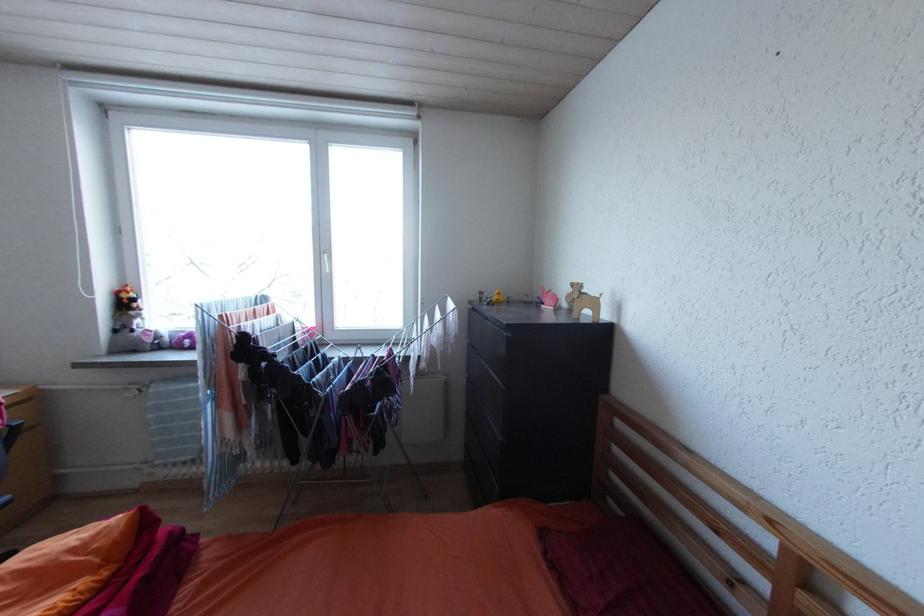
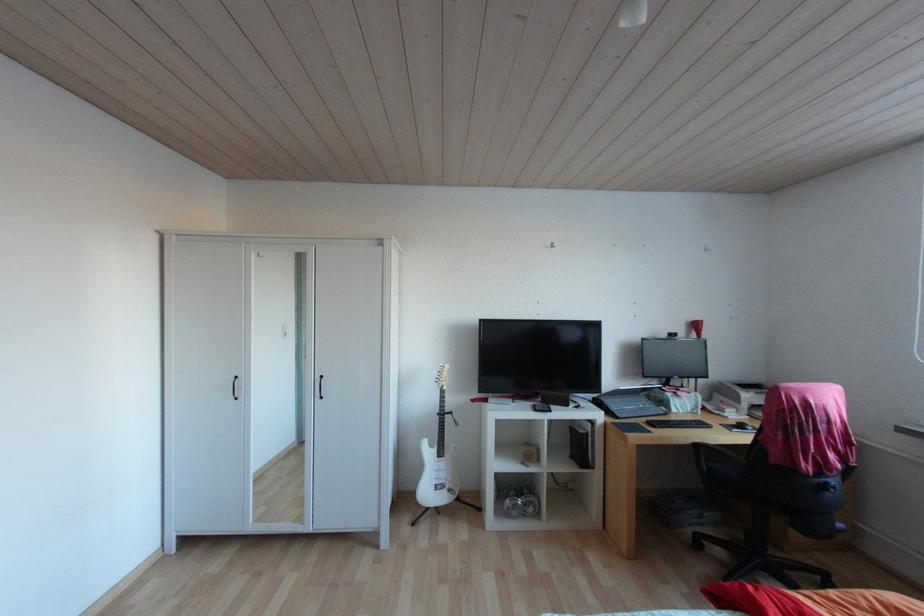
Question: The images are taken continuously from a first-person perspective. In which direction is your viewpoint rotating?

Choices:
 (A) Left
 (B) Right
 (C) Up
 (D) Down

Answer: (A)